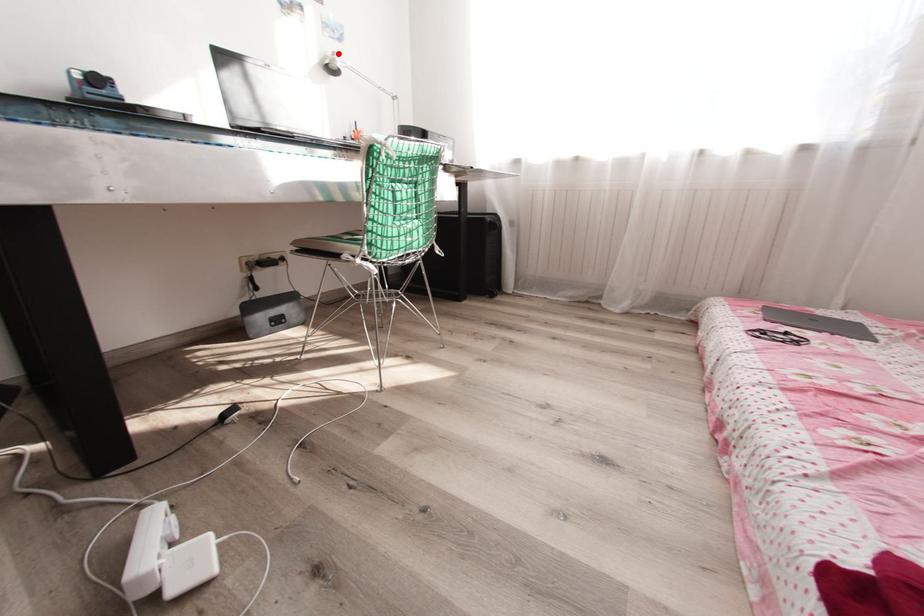
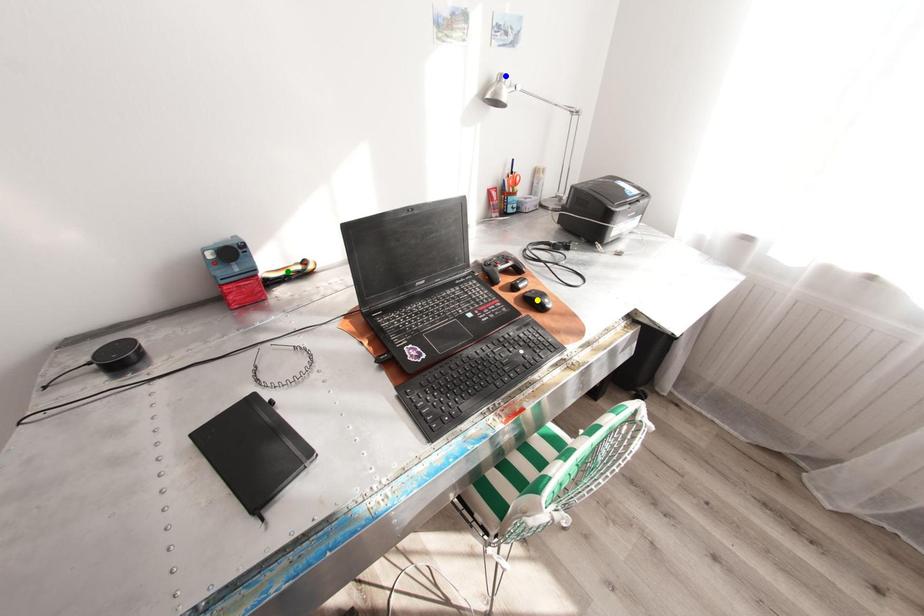
Question: I am providing you with two images of the same scene from different viewpoints. A red point is marked on the first image. You are given multiple points on the second image. Which mark in image 2 goes with the point in image 1?

Choices:
 (A) green point
 (B) blue point
 (C) yellow point

Answer: (B)